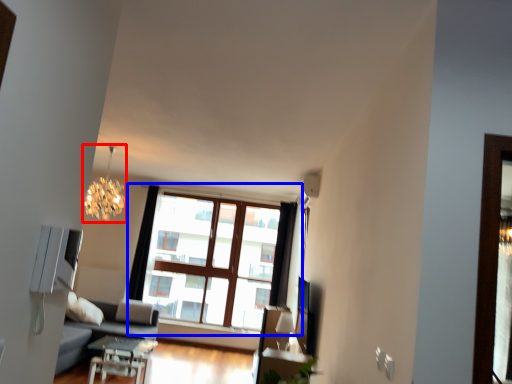
Question: Which object appears farthest to the camera in this image, lamp (highlighted by a red box) or window (highlighted by a blue box)?

Choices:
 (A) lamp
 (B) window

Answer: (B)